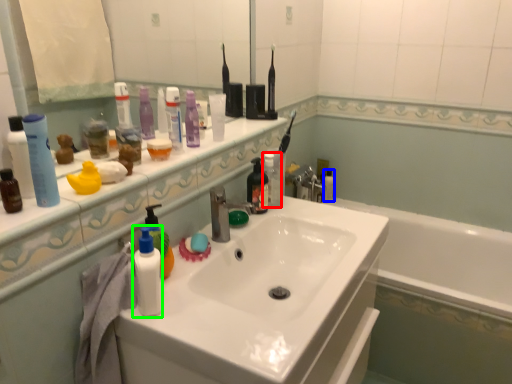
Question: Considering the real-world distances, which object is closest to toiletry (highlighted by a red box)? mouthwash (highlighted by a blue box) or toiletry (highlighted by a green box).

Choices:
 (A) mouthwash
 (B) toiletry

Answer: (B)